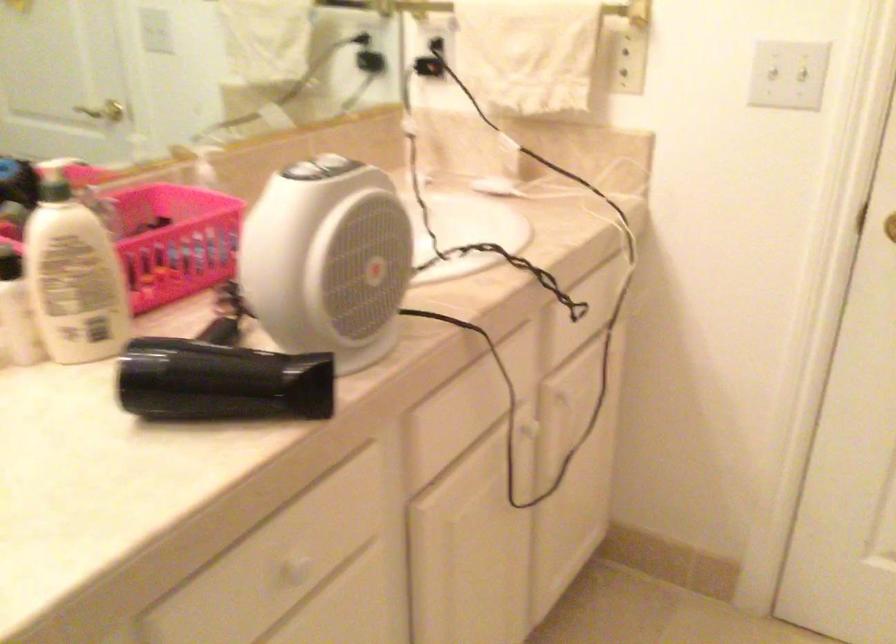
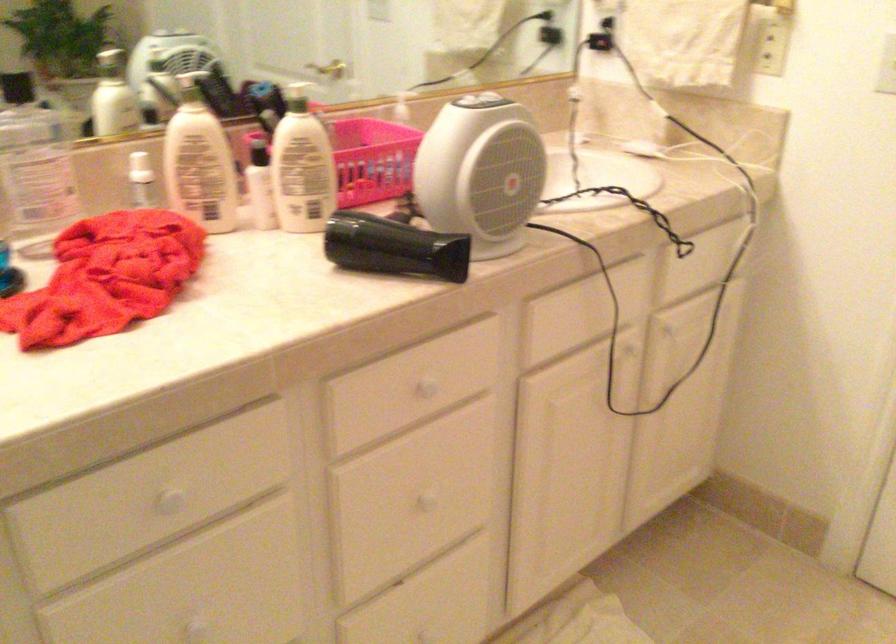
Locate, in the second image, the point that corresponds to (x=527, y=426) in the first image.

(625, 348)